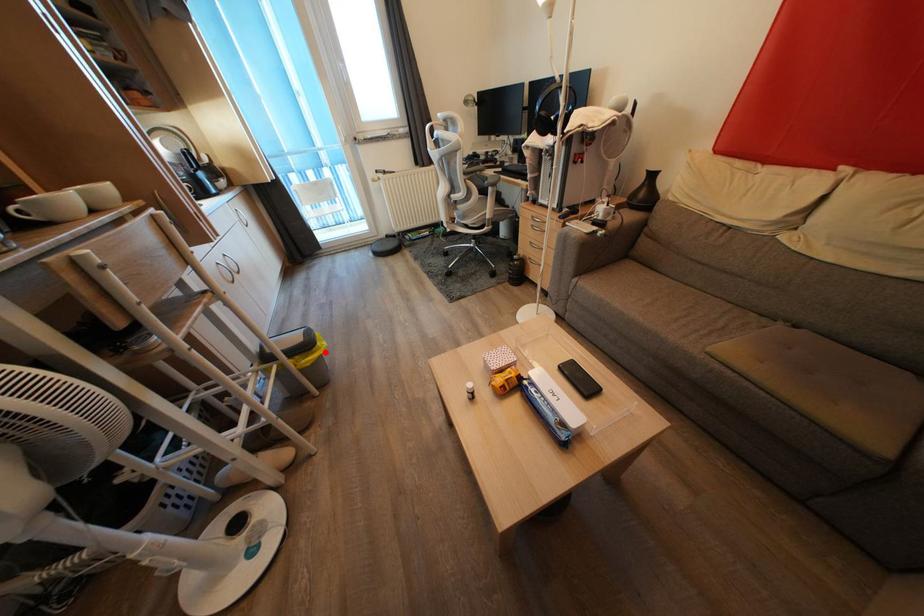
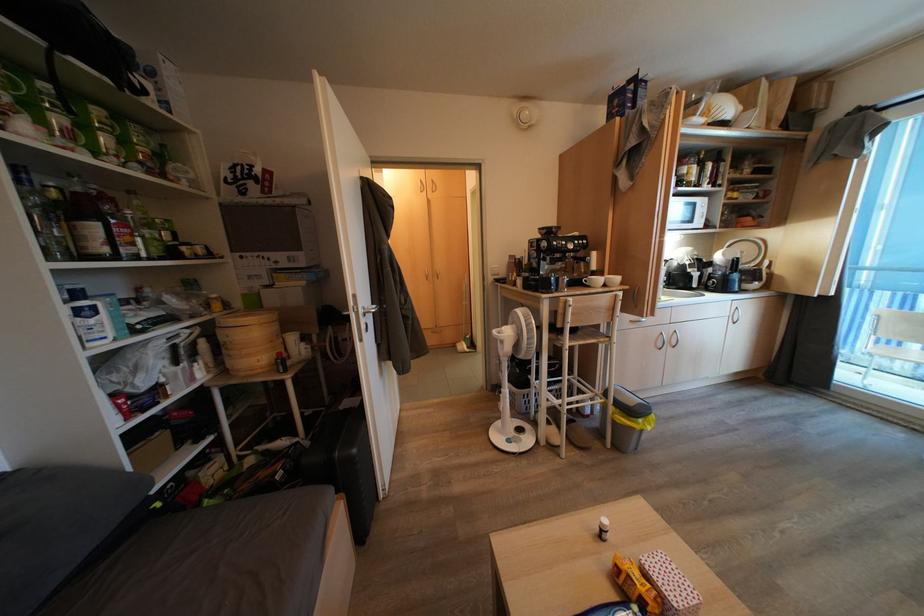
Question: A red point is marked in image1. In image2, is the corresponding 3D point closer to the camera or farther? Reply with the corresponding letter.

Choices:
 (A) The corresponding 3D point is closer.
 (B) The corresponding 3D point is farther.

Answer: (B)